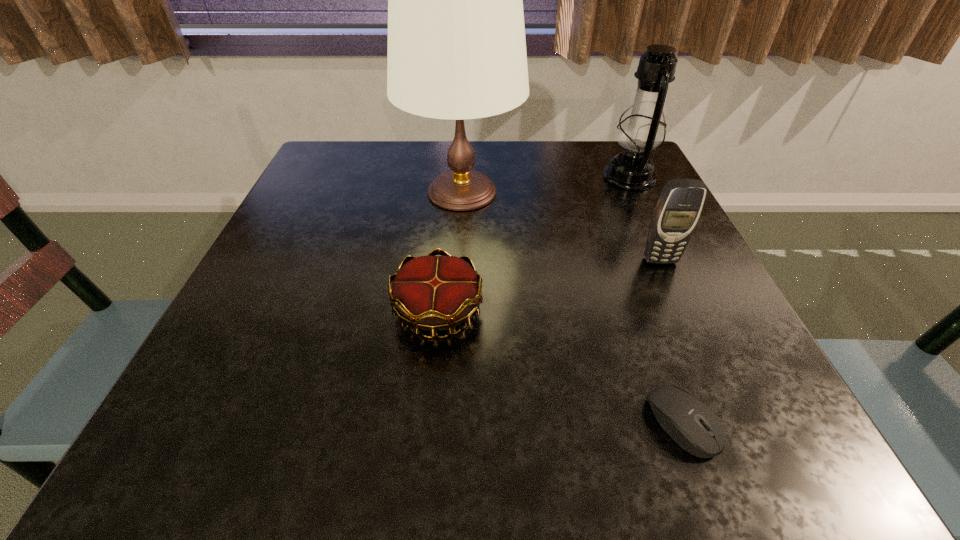
Locate an element on the screen. vacant space that is in between the lamp and the shortest object is located at coordinates (571, 307).

This screenshot has height=540, width=960. I want to click on unoccupied area between the third shortest object and the lamp, so click(561, 226).

This screenshot has height=540, width=960. Find the location of `empty location between the third tallest object and the shortest object`. empty location between the third tallest object and the shortest object is located at coordinates (671, 341).

What are the coordinates of `free space between the fourth tallest object and the computer equipment` in the screenshot? It's located at (560, 367).

The width and height of the screenshot is (960, 540). Find the location of `free area in between the oil lamp and the tallest object`. free area in between the oil lamp and the tallest object is located at coordinates (545, 185).

Locate an element on the screen. empty space that is in between the second tallest object and the shortest object is located at coordinates (656, 299).

This screenshot has width=960, height=540. Identify the location of free space between the third farthest object and the tallest object. (561, 226).

Identify the location of unoccupied area between the tallest object and the third nearest object. The image size is (960, 540). (561, 226).

Choose which object is the fourth nearest neighbor to the nearest object. Please provide its 2D coordinates. Your answer should be formatted as a tuple, i.e. [(x, y)], where the tuple contains the x and y coordinates of a point satisfying the conditions above.

[(641, 130)]

The width and height of the screenshot is (960, 540). I want to click on object that is the third closest one to the third shortest object, so click(688, 421).